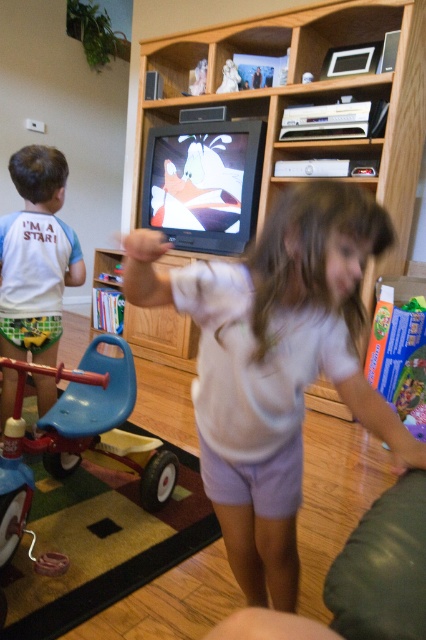
You are a parent trying to ensure the children play safely. The wooden entertainment center at center has a glass shelf. The blue plastic tricycle at lower left has a bell attached to its handle. Which object is closer to the moving girl to prevent her from knocking over the glass shelf?

The blue plastic tricycle at lower left is to the left of the wooden entertainment center at center, so the tricycle is closer to the moving girl. To prevent her from knocking over the glass shelf, move the tricycle away from the entertainment center or guide the girl to play farther from the entertainment center at center.

Based on the photo, you are standing in the living room and want to take a photo of the white cotton shirt at center. If your camera has a minimum focusing distance of 30 inches, will you be able to take a clear photo without moving closer?

The white cotton shirt at center is 31.61 inches away from the camera, which is slightly beyond the minimum focusing distance of 30 inches. Therefore, you can take a clear photo without moving closer because the distance is within the camera range.